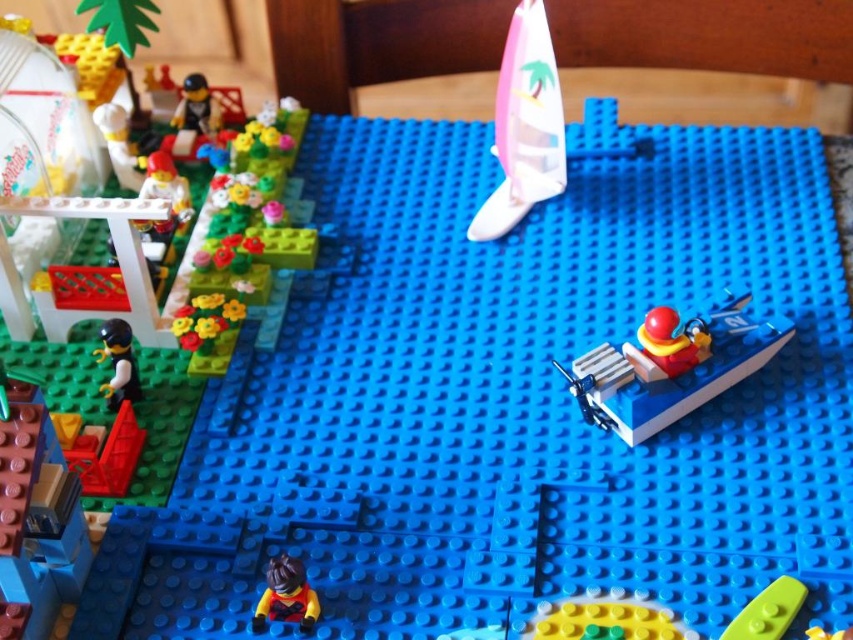
Question: Which of the following is the closest to the observer?

Choices:
 (A) black plastic minifigure at upper left
 (B) yellow matte minifigure at lower center
 (C) white plastic sailboat at upper center

Answer: (B)

Question: Does yellow matte minifigure at lower center appear on the right side of green plastic boat at lower right?

Choices:
 (A) yes
 (B) no

Answer: (B)

Question: Is white plastic boat at lower right wider than smooth brown brick at lower left?

Choices:
 (A) yes
 (B) no

Answer: (A)

Question: Estimate the real-world distances between objects in this image. Which object is closer to the smooth brown brick at lower left?

Choices:
 (A) black plastic minifigure at upper left
 (B) black matte minifigure at lower left
 (C) white plastic boat at lower right
 (D) white plastic sailboat at upper center

Answer: (B)

Question: Which of these objects is positioned closest to the green plastic boat at lower right?

Choices:
 (A) yellow matte minifigure at lower center
 (B) white plastic boat at lower right
 (C) black matte minifigure at lower left

Answer: (B)

Question: Can you confirm if smooth brown brick at lower left is positioned above black plastic minifigure at upper left?

Choices:
 (A) yes
 (B) no

Answer: (B)